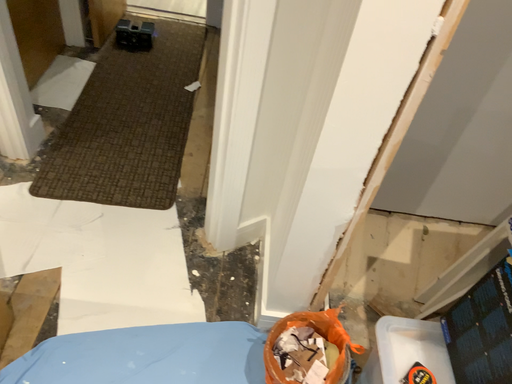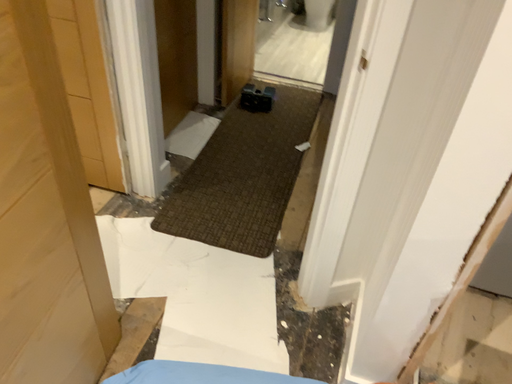
Question: Which way did the camera rotate in the video?

Choices:
 (A) rotated upward
 (B) rotated downward

Answer: (A)